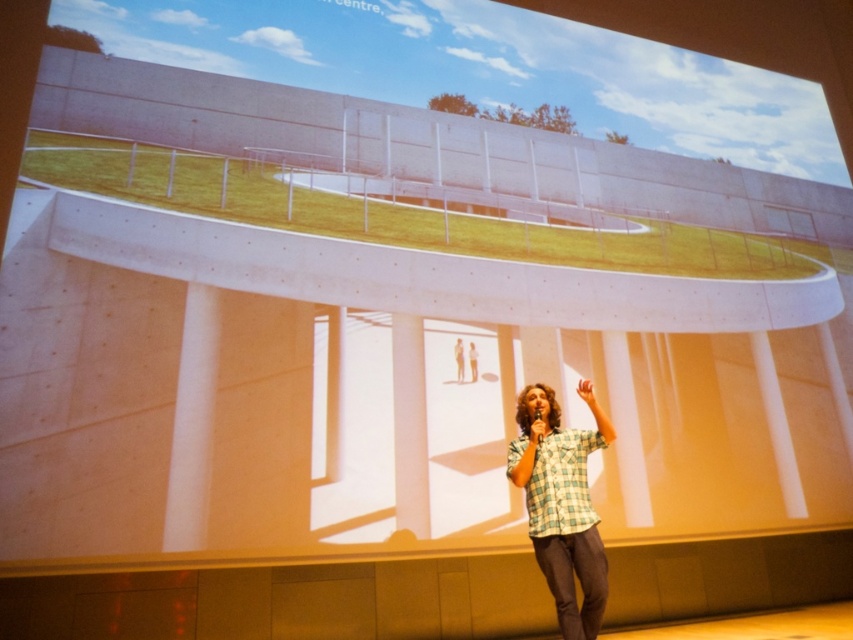
Is green plaid shirt at center above green checkered shirt at center?

No, green plaid shirt at center is not above green checkered shirt at center.

Is point (556, 572) farther from viewer compared to point (457, 378)?

No, it is not.

Locate an element on the screen. The image size is (853, 640). green plaid shirt at center is located at coordinates pyautogui.click(x=561, y=502).

Is point (463, 358) behind point (469, 355)?

No, it is not.

Between point (463, 353) and point (473, 362), which one is positioned behind?

The point (473, 362) is more distant.

This screenshot has width=853, height=640. Identify the location of green checkered shirt at center. (459, 358).

Identify the location of green checkered shirt at center. This screenshot has width=853, height=640. (459, 358).

Can you confirm if green plaid shirt at center is positioned to the right of light brown plaid shirt at center?

Correct, you'll find green plaid shirt at center to the right of light brown plaid shirt at center.

The width and height of the screenshot is (853, 640). What are the coordinates of `green plaid shirt at center` in the screenshot? It's located at (561, 502).